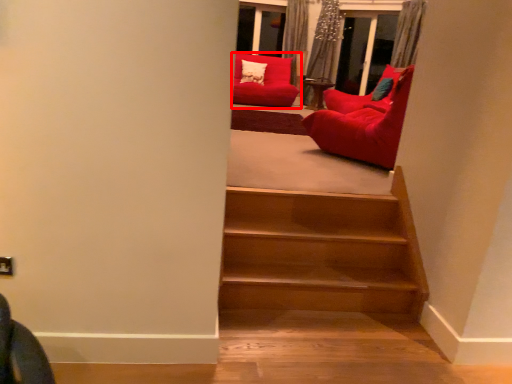
Question: Considering the relative positions of chair (annotated by the red box) and chair in the image provided, where is chair (annotated by the red box) located with respect to the staircase?

Choices:
 (A) left
 (B) right

Answer: (A)